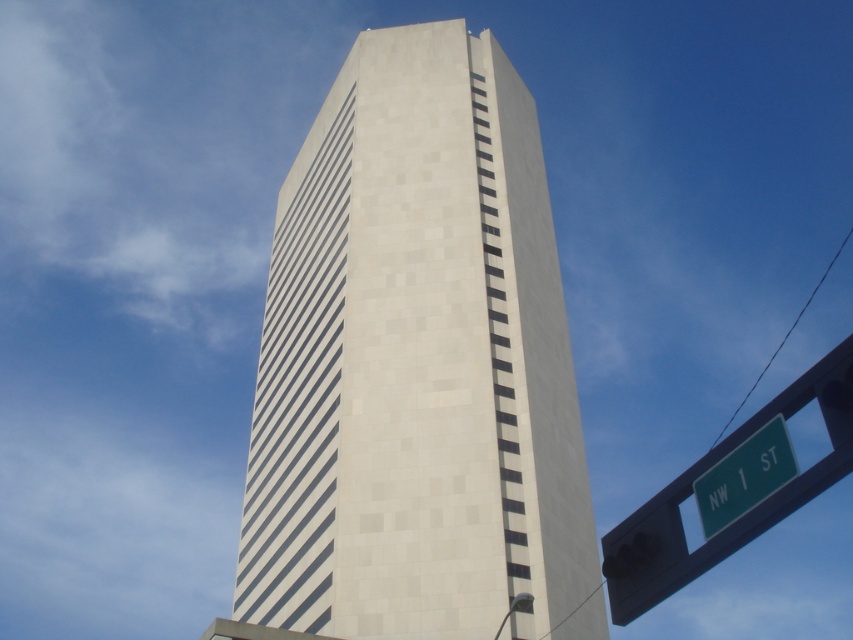
Question: Where is white textured building at center located in relation to green plastic street sign at lower right in the image?

Choices:
 (A) right
 (B) left

Answer: (B)

Question: Based on their relative distances, which object is nearer to the green metallic street sign at upper right?

Choices:
 (A) white textured building at center
 (B) green plastic street sign at lower right

Answer: (B)

Question: Which object is farther from the camera taking this photo?

Choices:
 (A) green metallic street sign at upper right
 (B) green plastic street sign at lower right

Answer: (B)

Question: Which point is closer to the camera?

Choices:
 (A) (753, 467)
 (B) (757, 518)

Answer: (B)

Question: Considering the relative positions of white textured building at center and green plastic street sign at lower right in the image provided, where is white textured building at center located with respect to green plastic street sign at lower right?

Choices:
 (A) right
 (B) left

Answer: (B)

Question: Is white textured building at center positioned in front of green metallic street sign at upper right?

Choices:
 (A) no
 (B) yes

Answer: (A)